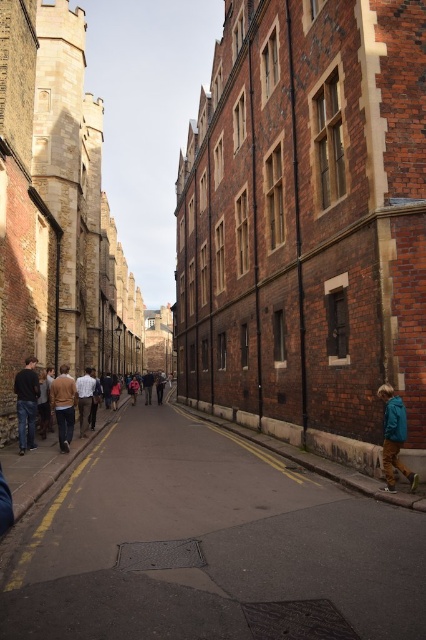
You are a delivery person standing on the street. You need to place a package on the smooth asphalt road at center without stepping on the dark blue jeans at left. Can you do this while staying on the road?

The smooth asphalt road at center is closer to the viewer than the dark blue jeans at left, so yes, you can place the package on the smooth asphalt road at center while staying on the road without stepping on the dark blue jeans at left.